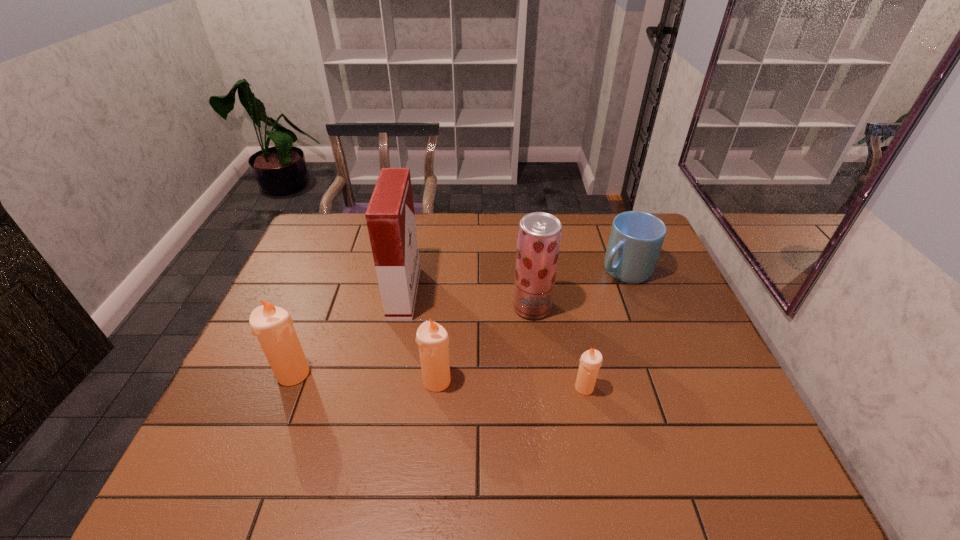
Where is `free space located 0.230m on the back of the fourth object from right to left`? The width and height of the screenshot is (960, 540). free space located 0.230m on the back of the fourth object from right to left is located at coordinates (444, 306).

The width and height of the screenshot is (960, 540). Identify the location of free space located 0.300m on the left of the shortest object. (453, 388).

In order to click on free region located 0.250m on the front-facing side of the second object from left to right in this screenshot , I will do `click(498, 293)`.

Identify the location of vacant space situated on the front of the fourth object from left to right. (536, 334).

This screenshot has height=540, width=960. I want to click on vacant space located 0.130m on the front of the rightmost object, so click(x=642, y=319).

This screenshot has width=960, height=540. Identify the location of object located at the left edge. (273, 326).

Locate an element on the screen. object at the right edge is located at coordinates (636, 238).

In the image, there is a desktop. At what (x,y) coordinates should I click in order to perform the action: click on free space at the far edge. Please return your answer as a coordinate pair (x, y). Looking at the image, I should click on (478, 232).

Find the location of a particular element. The height and width of the screenshot is (540, 960). blank space at the near edge is located at coordinates (642, 418).

Locate an element on the screen. free space at the left edge is located at coordinates (302, 308).